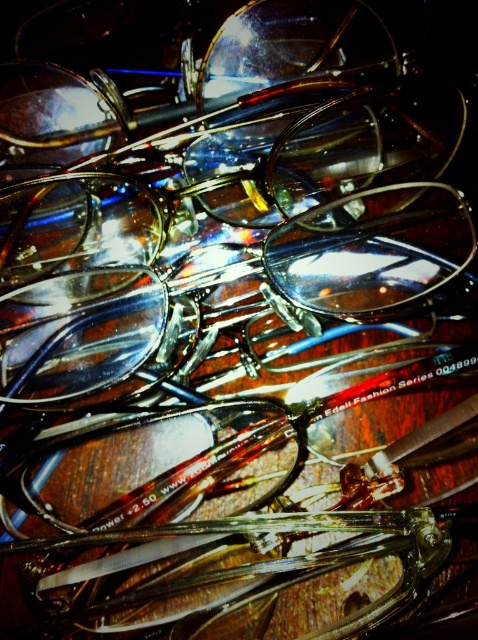
Is shiny brown glasses at center in front of shiny metallic glasses at center?

Yes, it is in front of shiny metallic glasses at center.

Which is above, shiny brown glasses at center or shiny metallic glasses at center?

shiny brown glasses at center

Image resolution: width=478 pixels, height=640 pixels. I want to click on shiny brown glasses at center, so click(227, 179).

Find the location of `shiny brown glasses at center`. shiny brown glasses at center is located at coordinates (227, 179).